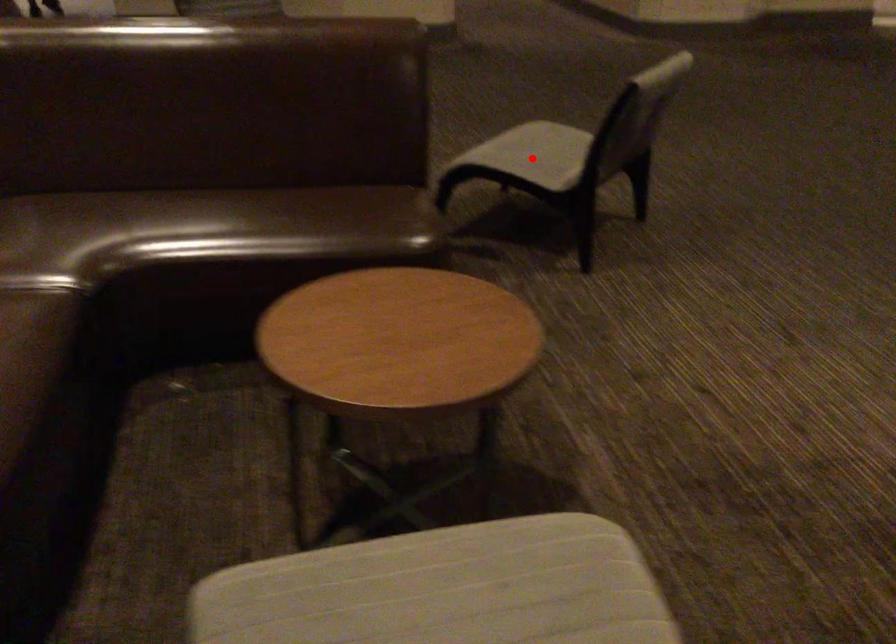
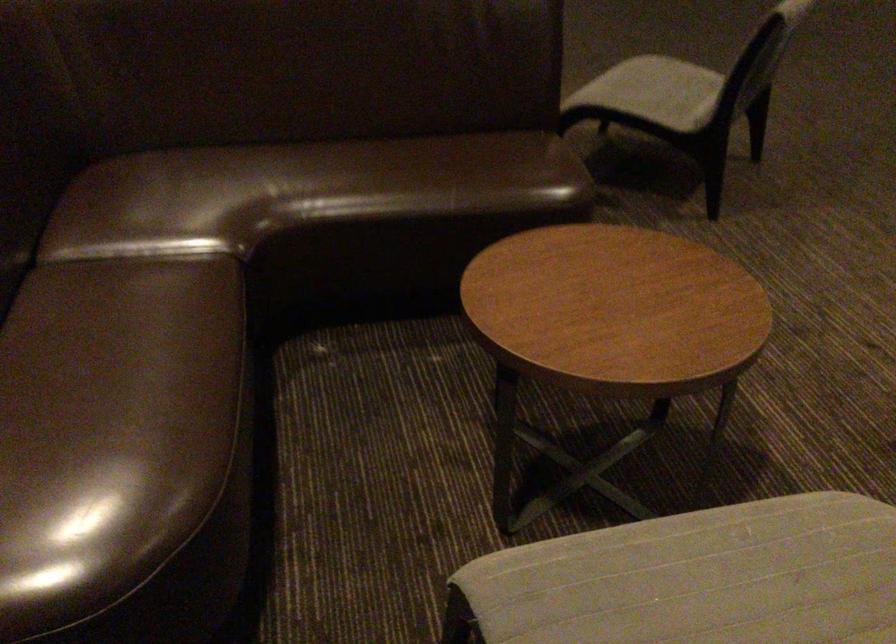
In the second image, find the point that corresponds to the highlighted location in the first image.

(655, 91)